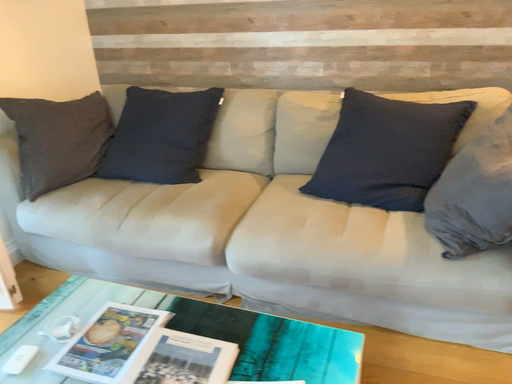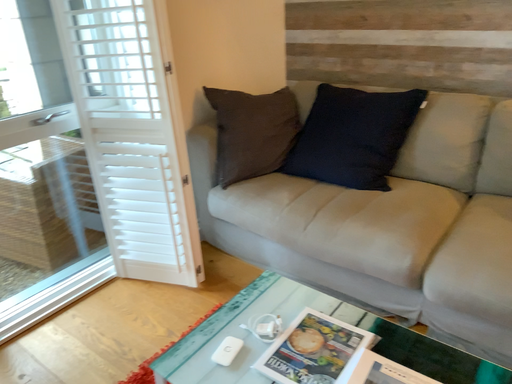
Question: How did the camera likely rotate when shooting the video?

Choices:
 (A) rotated right
 (B) rotated left

Answer: (B)